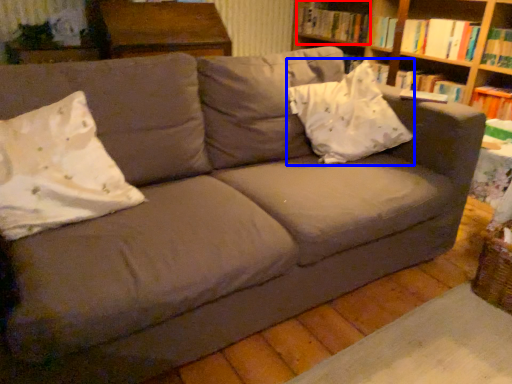
Question: Which object is closer to the camera taking this photo, book (highlighted by a red box) or throw pillow (highlighted by a blue box)?

Choices:
 (A) book
 (B) throw pillow

Answer: (B)